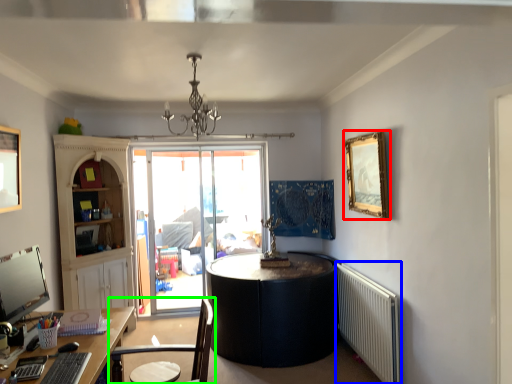
Question: Which object is positioned closest to picture frame (highlighted by a red box)? Select from radiator (highlighted by a blue box) and chair (highlighted by a green box).

Choices:
 (A) radiator
 (B) chair

Answer: (A)